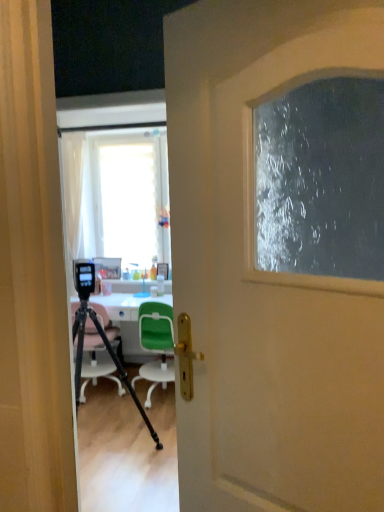
Question: From a real-world perspective, does translucent plastic bottle at center stand above black matte tripod at center?

Choices:
 (A) yes
 (B) no

Answer: (A)

Question: Does translucent plastic bottle at center have a larger size compared to black matte tripod at center?

Choices:
 (A) no
 (B) yes

Answer: (A)

Question: Is translucent plastic bottle at center closer to the viewer compared to black matte tripod at center?

Choices:
 (A) yes
 (B) no

Answer: (B)

Question: Considering the relative sizes of translucent plastic bottle at center and black matte tripod at center in the image provided, is translucent plastic bottle at center taller than black matte tripod at center?

Choices:
 (A) no
 (B) yes

Answer: (A)

Question: Is translucent plastic bottle at center positioned behind black matte tripod at center?

Choices:
 (A) no
 (B) yes

Answer: (B)

Question: In the image, is green plastic chair at center, the second chair positioned from the left, on the left side or the right side of black matte tripod at center?

Choices:
 (A) left
 (B) right

Answer: (B)

Question: Considering the positions of green plastic chair at center, placed as the first chair when sorted from right to left, and black matte tripod at center in the image, is green plastic chair at center, placed as the first chair when sorted from right to left, wider or thinner than black matte tripod at center?

Choices:
 (A) wide
 (B) thin

Answer: (A)

Question: Considering the positions of green plastic chair at center, the second chair positioned from the left, and black matte tripod at center in the image, is green plastic chair at center, the second chair positioned from the left, taller or shorter than black matte tripod at center?

Choices:
 (A) short
 (B) tall

Answer: (A)

Question: Relative to black matte tripod at center, is green plastic chair at center, placed as the first chair when sorted from right to left, in front or behind?

Choices:
 (A) behind
 (B) front

Answer: (A)

Question: In terms of width, does black matte tripod at center look wider or thinner when compared to green plastic chair at center, placed as the first chair when sorted from right to left?

Choices:
 (A) wide
 (B) thin

Answer: (B)

Question: Does point (74, 324) appear closer or farther from the camera than point (139, 316)?

Choices:
 (A) closer
 (B) farther

Answer: (A)

Question: Do you think black matte tripod at center is within green plastic chair at center, the second chair positioned from the left, or outside of it?

Choices:
 (A) inside
 (B) outside

Answer: (B)

Question: Based on their sizes in the image, would you say black matte tripod at center is bigger or smaller than green plastic chair at center, the second chair positioned from the left?

Choices:
 (A) small
 (B) big

Answer: (B)

Question: Is point (129, 352) closer or farther from the camera than point (140, 370)?

Choices:
 (A) farther
 (B) closer

Answer: (A)

Question: Looking at their shapes, would you say white glossy desk at center is wider or thinner than green plastic chair at center, the second chair positioned from the left?

Choices:
 (A) thin
 (B) wide

Answer: (B)